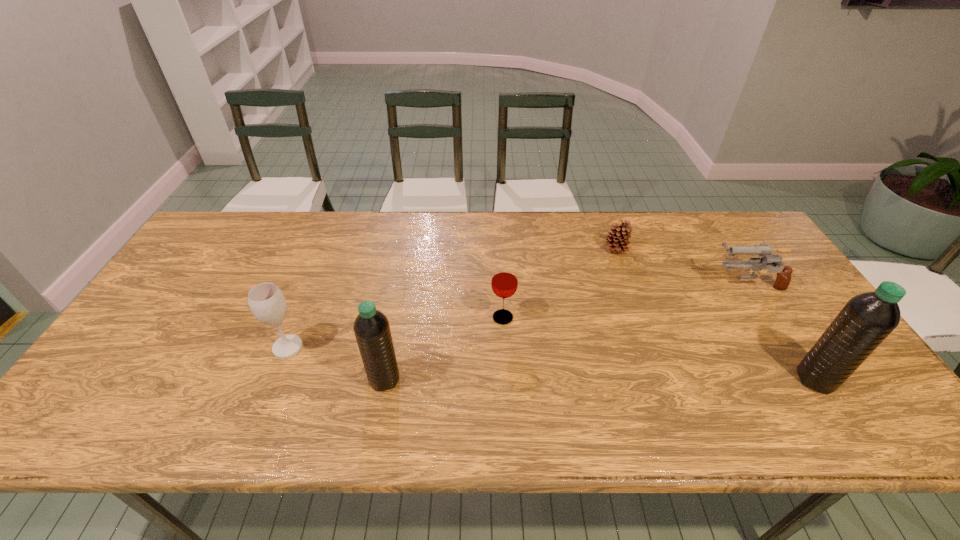
Locate an element on the screen. empty location between the fifth nearest object and the glass is located at coordinates (625, 300).

Identify the location of vacant space that's between the shorter water bottle and the gun. (565, 331).

Where is `empty space between the left water bottle and the fifth nearest object`? Image resolution: width=960 pixels, height=540 pixels. empty space between the left water bottle and the fifth nearest object is located at coordinates coord(565,331).

The height and width of the screenshot is (540, 960). I want to click on vacant area that lies between the taller water bottle and the shorter water bottle, so click(600, 379).

You are a GUI agent. You are given a task and a screenshot of the screen. Output one action in this format:
    pyautogui.click(x=<x>, y=<y>)
    Task: Click on the free space between the leftmost object and the farthest object
    This screenshot has width=960, height=540.
    Given the screenshot: What is the action you would take?
    coord(452,298)

I want to click on free space between the wineglass and the farthest object, so click(x=452, y=298).

This screenshot has width=960, height=540. In order to click on empty location between the fifth nearest object and the left water bottle in this screenshot , I will do `click(565, 331)`.

Where is `object that is the fifth closest to the taller water bottle`? This screenshot has width=960, height=540. object that is the fifth closest to the taller water bottle is located at coordinates (267, 303).

Identify the location of object identified as the second closest to the third object from left to right. (617, 240).

Image resolution: width=960 pixels, height=540 pixels. In order to click on free space that satisfies the following two spatial constraints: 1. on the back side of the pinecone; 2. on the left side of the glass in this screenshot , I will do `click(499, 249)`.